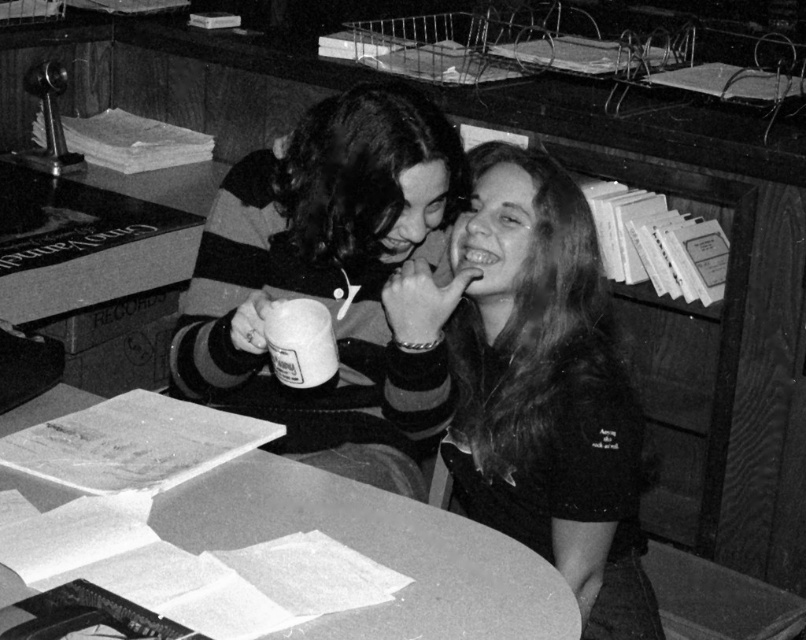
Question: Can you confirm if striped sweater at center is wider than smooth paper documents at center?

Choices:
 (A) no
 (B) yes

Answer: (A)

Question: Which point appears closest to the camera in this image?

Choices:
 (A) (547, 355)
 (B) (183, 310)

Answer: (A)

Question: Considering the relative positions of smooth black shirt at center and striped sweater at center in the image provided, where is smooth black shirt at center located with respect to striped sweater at center?

Choices:
 (A) left
 (B) right

Answer: (B)

Question: Considering the relative positions of striped sweater at center and smooth paper documents at center in the image provided, where is striped sweater at center located with respect to smooth paper documents at center?

Choices:
 (A) above
 (B) below

Answer: (A)

Question: Which point appears closest to the camera in this image?

Choices:
 (A) (559, 179)
 (B) (260, 470)
 (C) (322, 145)

Answer: (B)

Question: Estimate the real-world distances between objects in this image. Which object is farther from the smooth black shirt at center?

Choices:
 (A) striped sweater at center
 (B) smooth paper documents at center

Answer: (B)